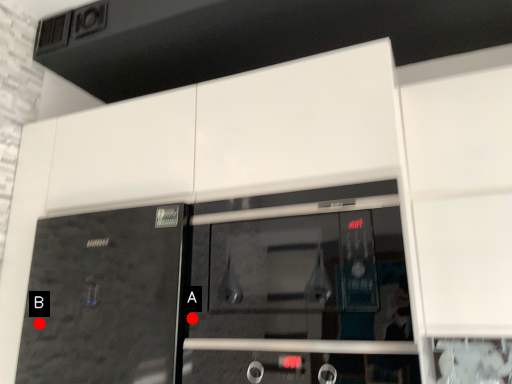
Question: Two points are circled on the image, labeled by A and B beside each circle. Which of the following is the farthest from the observer?

Choices:
 (A) A is further
 (B) B is further

Answer: (B)